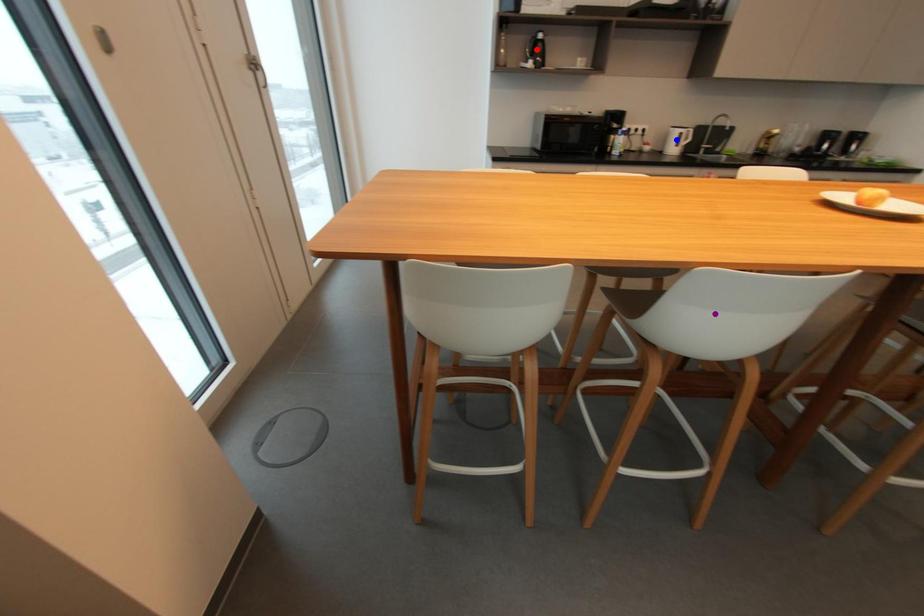
Order these from farthest to nearest:
1. purple point
2. red point
3. blue point

1. blue point
2. red point
3. purple point